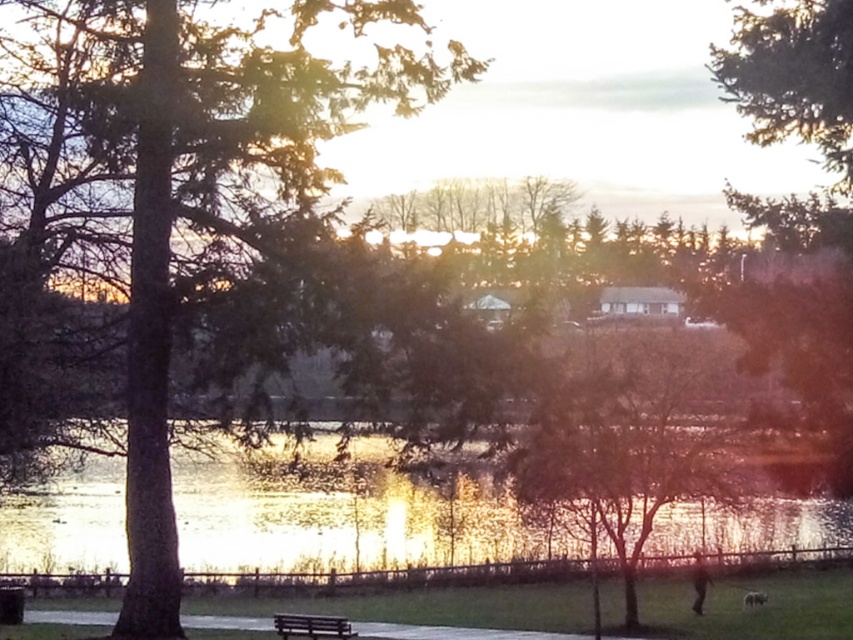
Who is positioned more to the left, green textured tree at left or bare branches at center?

Positioned to the left is green textured tree at left.

Does green textured tree at left come in front of bare branches at center?

That is True.

Where is `green textured tree at left`? This screenshot has width=853, height=640. green textured tree at left is located at coordinates (193, 232).

Is glistening reflective water at center wider than wooden bench at lower center?

Yes, glistening reflective water at center is wider than wooden bench at lower center.

Can you confirm if glistening reflective water at center is bigger than wooden bench at lower center?

Yes.

Which is behind, point (306, 540) or point (347, 618)?

The point (306, 540) is behind.

The height and width of the screenshot is (640, 853). I want to click on glistening reflective water at center, so click(343, 518).

The width and height of the screenshot is (853, 640). What do you see at coordinates (193, 232) in the screenshot?
I see `green textured tree at left` at bounding box center [193, 232].

Does green textured tree at left lie behind glistening reflective water at center?

No, green textured tree at left is in front of glistening reflective water at center.

Is point (155, 289) farther from camera compared to point (254, 525)?

No, it is in front of (254, 525).

Image resolution: width=853 pixels, height=640 pixels. I want to click on green textured tree at left, so click(x=193, y=232).